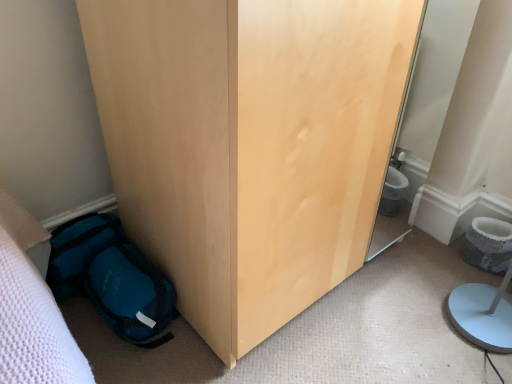
Question: Relative to gray textured toilet bowl at lower right, is teal fabric backpack at lower left in front or behind?

Choices:
 (A) front
 (B) behind

Answer: (A)

Question: Considering the positions of teal fabric backpack at lower left and gray textured toilet bowl at lower right in the image, is teal fabric backpack at lower left wider or thinner than gray textured toilet bowl at lower right?

Choices:
 (A) wide
 (B) thin

Answer: (A)

Question: Considering the real-world distances, which object is closest to the gray textured toilet bowl at lower right?

Choices:
 (A) matte wood wardrobe at lower left
 (B) teal fabric backpack at lower left

Answer: (A)

Question: Which object is positioned closest to the gray textured toilet bowl at lower right?

Choices:
 (A) matte wood wardrobe at lower left
 (B) teal fabric backpack at lower left

Answer: (A)